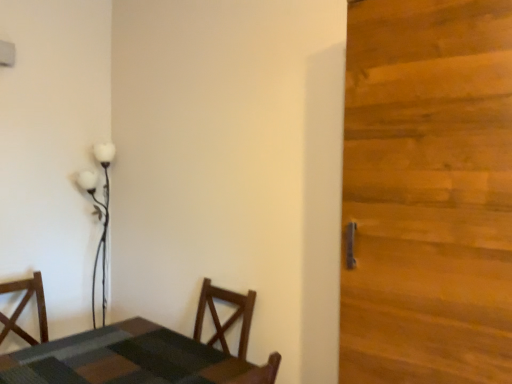
Question: Are wooden door at right and textured wood table at lower left making contact?

Choices:
 (A) no
 (B) yes

Answer: (A)

Question: From the image's perspective, would you say wooden door at right is positioned over textured wood table at lower left?

Choices:
 (A) no
 (B) yes

Answer: (B)

Question: Is wooden door at right outside textured wood table at lower left?

Choices:
 (A) yes
 (B) no

Answer: (A)

Question: From the image's perspective, is wooden door at right below textured wood table at lower left?

Choices:
 (A) no
 (B) yes

Answer: (A)

Question: Is wooden door at right smaller than textured wood table at lower left?

Choices:
 (A) no
 (B) yes

Answer: (A)

Question: From the image's perspective, is white glossy floor lamp at upper left above or below wooden door at right?

Choices:
 (A) below
 (B) above

Answer: (A)

Question: From a real-world perspective, is white glossy floor lamp at upper left physically located above or below wooden door at right?

Choices:
 (A) below
 (B) above

Answer: (A)

Question: Considering the positions of white glossy floor lamp at upper left and wooden door at right in the image, is white glossy floor lamp at upper left taller or shorter than wooden door at right?

Choices:
 (A) short
 (B) tall

Answer: (A)

Question: Considering the positions of white glossy floor lamp at upper left and wooden door at right in the image, is white glossy floor lamp at upper left bigger or smaller than wooden door at right?

Choices:
 (A) small
 (B) big

Answer: (A)

Question: Is textured wood table at lower left taller or shorter than white glossy floor lamp at upper left?

Choices:
 (A) tall
 (B) short

Answer: (B)

Question: From the image's perspective, is textured wood table at lower left positioned above or below white glossy floor lamp at upper left?

Choices:
 (A) above
 (B) below

Answer: (B)

Question: Is textured wood table at lower left wider or thinner than white glossy floor lamp at upper left?

Choices:
 (A) wide
 (B) thin

Answer: (A)

Question: Is point (10, 360) positioned closer to the camera than point (96, 157)?

Choices:
 (A) farther
 (B) closer

Answer: (B)

Question: In terms of height, does wooden door at right look taller or shorter compared to white glossy floor lamp at upper left?

Choices:
 (A) short
 (B) tall

Answer: (B)

Question: Is wooden door at right to the left or to the right of white glossy floor lamp at upper left in the image?

Choices:
 (A) right
 (B) left

Answer: (A)